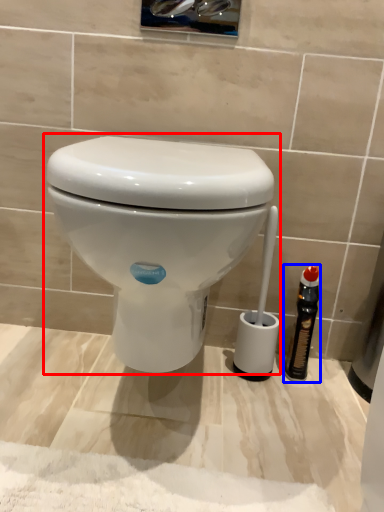
Question: Among these objects, which one is farthest to the camera, toilet (highlighted by a red box) or bottle (highlighted by a blue box)?

Choices:
 (A) toilet
 (B) bottle

Answer: (B)